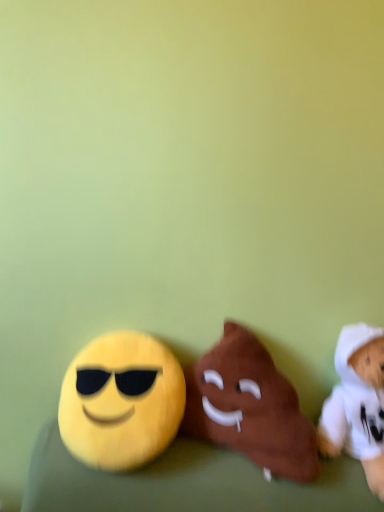
Question: Could you tell me if brown plush poop at center, arranged as the second toy when viewed from the right, is turned towards white plush toy at right, the first toy viewed from the right?

Choices:
 (A) no
 (B) yes

Answer: (A)

Question: Is brown plush poop at center, which is the 2th toy in left-to-right order, further to the viewer compared to white plush toy at right, arranged as the 3th toy when viewed from the left?

Choices:
 (A) yes
 (B) no

Answer: (A)

Question: From the image's perspective, is brown plush poop at center, which is the 2th toy in left-to-right order, over white plush toy at right, arranged as the 3th toy when viewed from the left?

Choices:
 (A) no
 (B) yes

Answer: (B)

Question: Is brown plush poop at center, arranged as the second toy when viewed from the right, thinner than white plush toy at right, arranged as the 3th toy when viewed from the left?

Choices:
 (A) no
 (B) yes

Answer: (A)

Question: Is the depth of brown plush poop at center, which is the 2th toy in left-to-right order, less than that of white plush toy at right, the first toy viewed from the right?

Choices:
 (A) yes
 (B) no

Answer: (B)

Question: Considering the positions of point (97, 381) and point (241, 358), is point (97, 381) closer or farther from the camera than point (241, 358)?

Choices:
 (A) closer
 (B) farther

Answer: (A)

Question: In the image, is yellow plush at left, the first toy from the left, positioned in front of or behind brown plush poop at center, arranged as the second toy when viewed from the right?

Choices:
 (A) front
 (B) behind

Answer: (B)

Question: Looking at their shapes, would you say yellow plush at left, the first toy from the left, is wider or thinner than brown plush poop at center, which is the 2th toy in left-to-right order?

Choices:
 (A) thin
 (B) wide

Answer: (A)

Question: From the image's perspective, is yellow plush at left, the third toy positioned from the right, located above or below brown plush poop at center, arranged as the second toy when viewed from the right?

Choices:
 (A) above
 (B) below

Answer: (A)

Question: Relative to yellow plush at left, the first toy from the left, is white plush toy at right, arranged as the 3th toy when viewed from the left, in front or behind?

Choices:
 (A) behind
 (B) front

Answer: (B)

Question: Is point (365, 451) closer or farther from the camera than point (87, 420)?

Choices:
 (A) farther
 (B) closer

Answer: (A)

Question: From a real-world perspective, is white plush toy at right, the first toy viewed from the right, physically located above or below yellow plush at left, the third toy positioned from the right?

Choices:
 (A) above
 (B) below

Answer: (A)

Question: Visually, is white plush toy at right, the first toy viewed from the right, positioned to the left or to the right of yellow plush at left, the first toy from the left?

Choices:
 (A) right
 (B) left

Answer: (A)

Question: Looking at their shapes, would you say yellow plush at left, the third toy positioned from the right, is wider or thinner than white plush toy at right, arranged as the 3th toy when viewed from the left?

Choices:
 (A) wide
 (B) thin

Answer: (B)

Question: Would you say yellow plush at left, the first toy from the left, is inside or outside white plush toy at right, the first toy viewed from the right?

Choices:
 (A) outside
 (B) inside

Answer: (A)